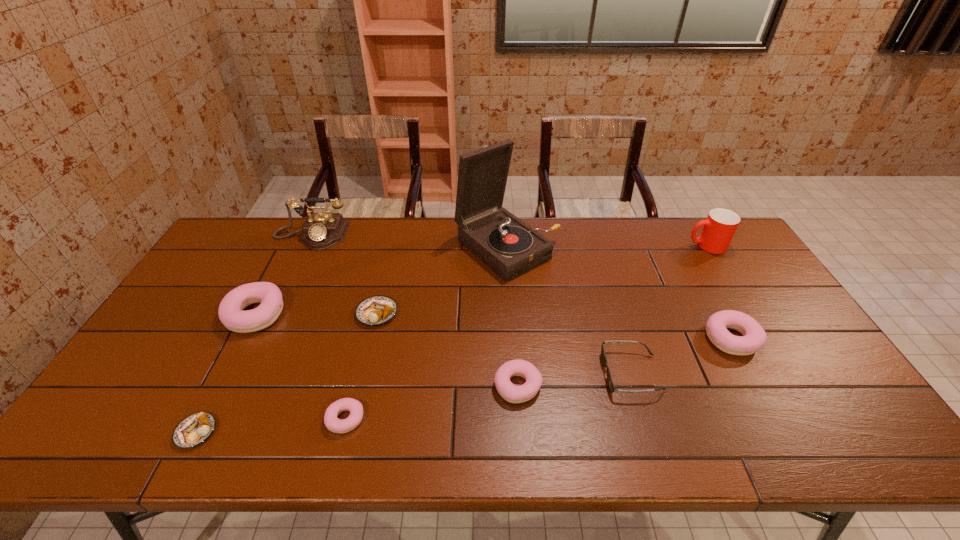
This screenshot has height=540, width=960. What are the coordinates of `the third pink pastry from left to right` in the screenshot? It's located at (512, 393).

Find the location of a particular element. The image size is (960, 540). the bigger brown pastry is located at coordinates (376, 310).

Where is `the right brown pastry`? the right brown pastry is located at coordinates (376, 310).

This screenshot has width=960, height=540. Identify the location of the third object from right to left. (612, 388).

This screenshot has width=960, height=540. Find the location of `black sunglasses`. black sunglasses is located at coordinates (612, 388).

Locate an element on the screen. This screenshot has height=540, width=960. the second pink pastry from left to right is located at coordinates (336, 425).

This screenshot has width=960, height=540. Identify the location of the smaller brown pastry. click(x=193, y=430).

I want to click on the left brown pastry, so click(x=193, y=430).

Where is `free spot located on the right of the tallest object`? This screenshot has width=960, height=540. free spot located on the right of the tallest object is located at coordinates (598, 248).

This screenshot has width=960, height=540. Find the location of `free space located 0.260m on the dial of the black telephone`. free space located 0.260m on the dial of the black telephone is located at coordinates (278, 305).